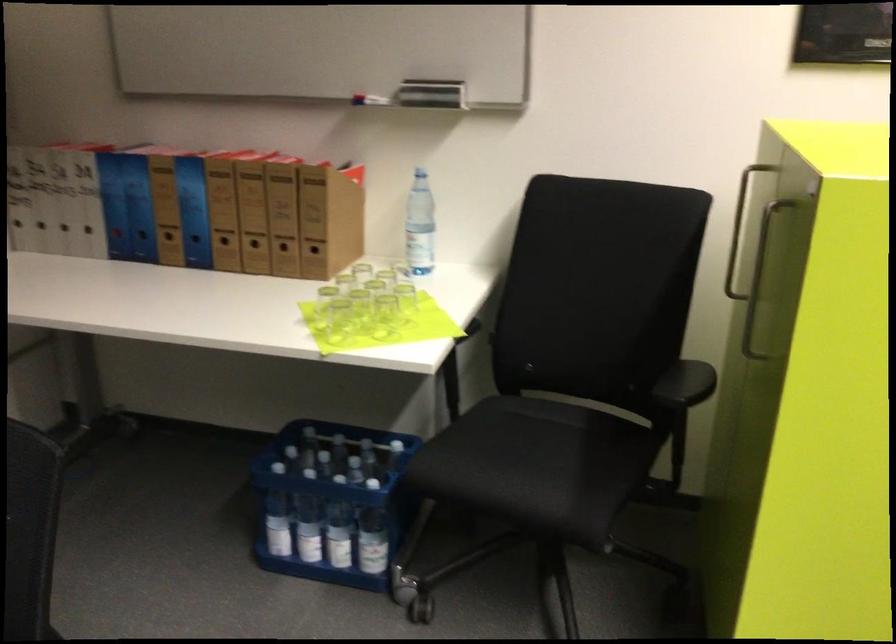
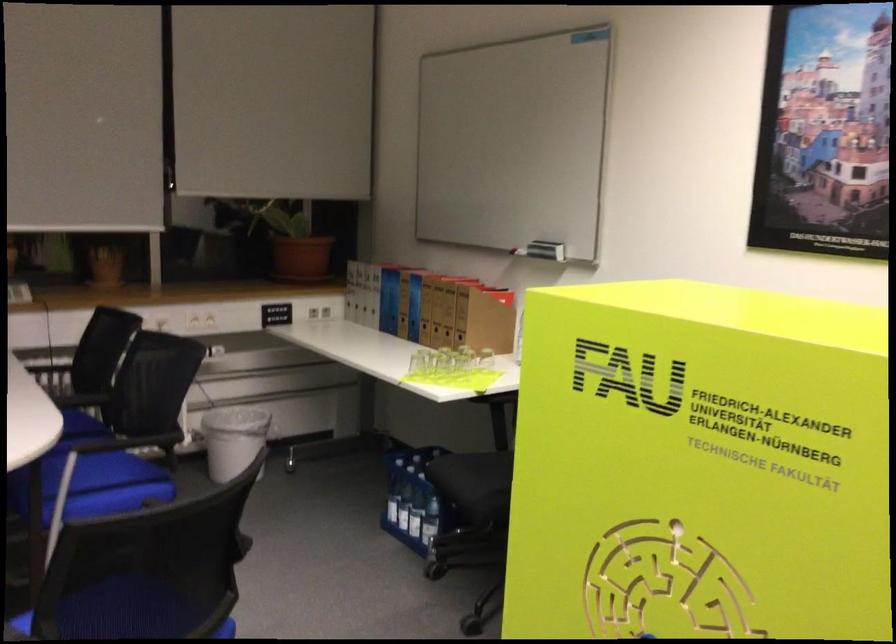
Where in the second image is the point corresponding to (x=328, y=529) from the first image?

(416, 514)